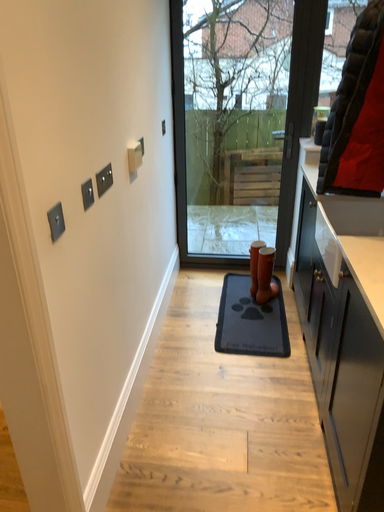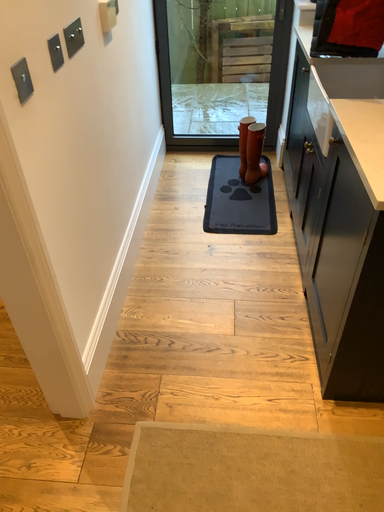
Question: Which way did the camera rotate in the video?

Choices:
 (A) rotated upward
 (B) rotated downward

Answer: (B)